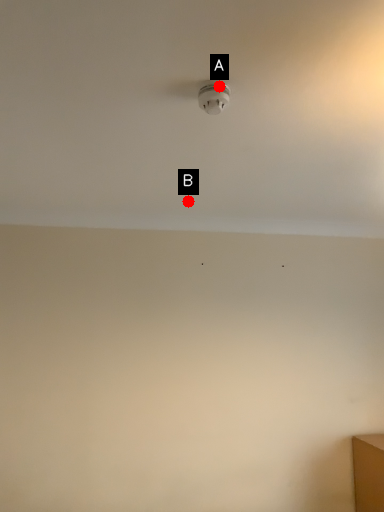
Question: Two points are circled on the image, labeled by A and B beside each circle. Which point is farther from the camera taking this photo?

Choices:
 (A) A is further
 (B) B is further

Answer: (B)